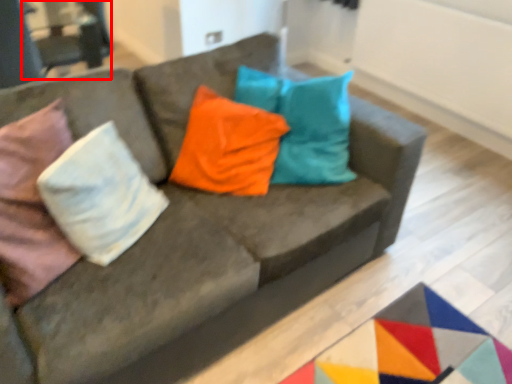
Question: Considering the relative positions of armchair (annotated by the red box) and pillow in the image provided, where is armchair (annotated by the red box) located with respect to the staircase?

Choices:
 (A) left
 (B) right

Answer: (A)